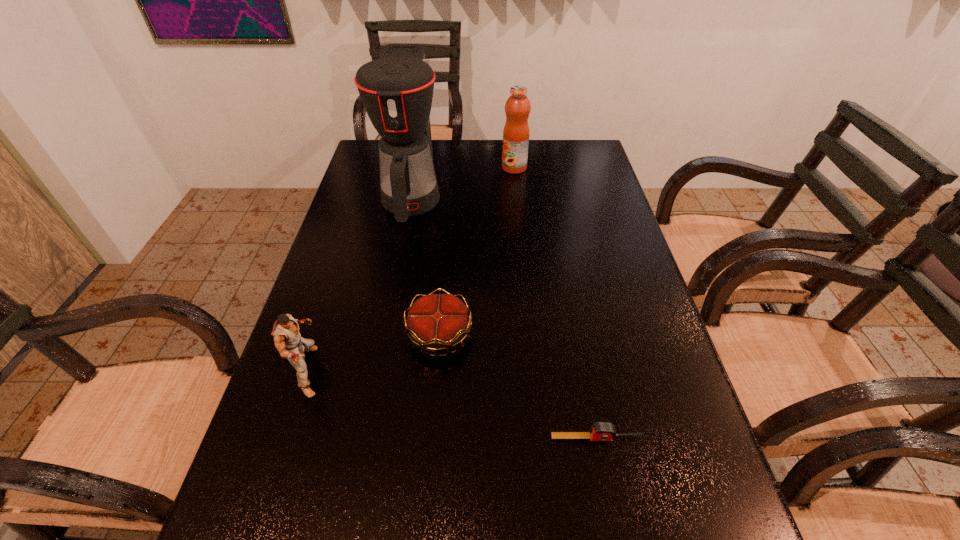
Identify the location of the tallest object. The width and height of the screenshot is (960, 540). (397, 89).

In order to click on fruit juice in this screenshot , I will do `click(516, 132)`.

Image resolution: width=960 pixels, height=540 pixels. I want to click on puncher, so [288, 341].

Image resolution: width=960 pixels, height=540 pixels. I want to click on the third tallest object, so click(288, 341).

This screenshot has height=540, width=960. In order to click on crown in this screenshot , I will do `click(436, 322)`.

This screenshot has height=540, width=960. I want to click on the nearest object, so click(600, 431).

Where is `the shortest object`? The height and width of the screenshot is (540, 960). the shortest object is located at coordinates (600, 431).

Locate an element on the screen. This screenshot has width=960, height=540. vacant area located 0.340m pour from the carafe of the coffee maker is located at coordinates [386, 332].

Where is `free space located 0.060m on the front label of the fruit juice`? The height and width of the screenshot is (540, 960). free space located 0.060m on the front label of the fruit juice is located at coordinates (484, 168).

This screenshot has height=540, width=960. What are the coordinates of `free region located 0.120m on the front label of the fruit juice` in the screenshot? It's located at (467, 168).